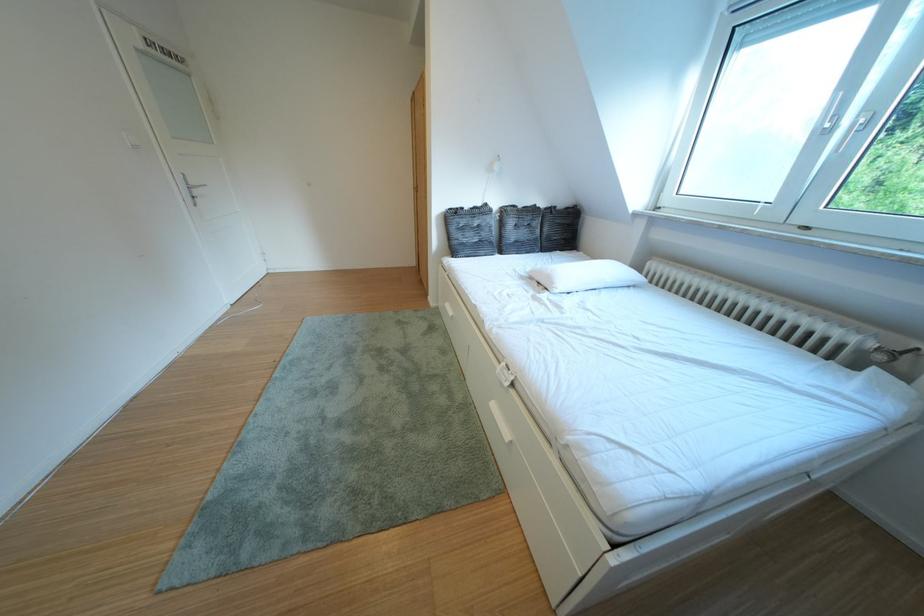
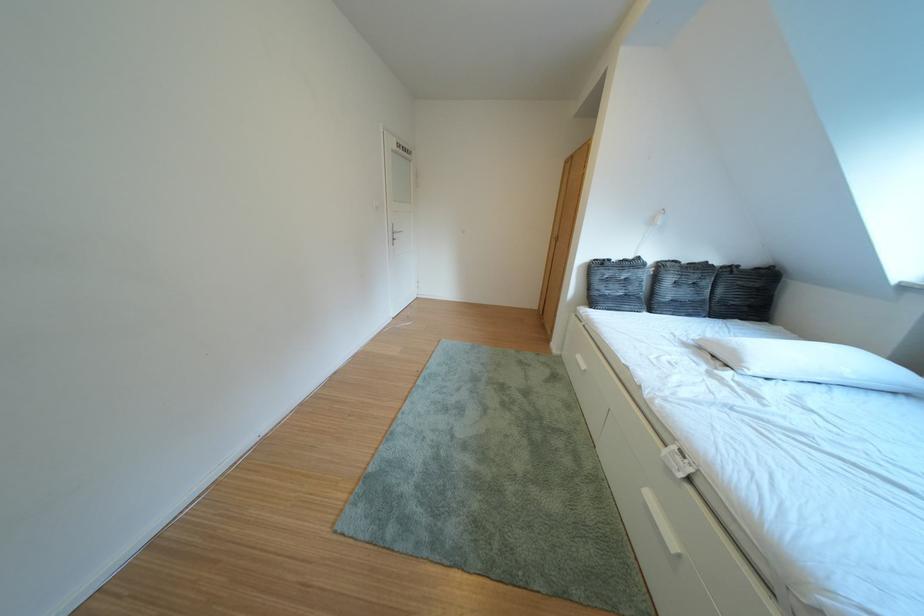
Question: The camera is either moving clockwise (left) or counter-clockwise (right) around the object. The first image is from the beginning of the video and the second image is from the end. Is the camera moving left or right when shooting the video?

Choices:
 (A) Left
 (B) Right

Answer: (B)